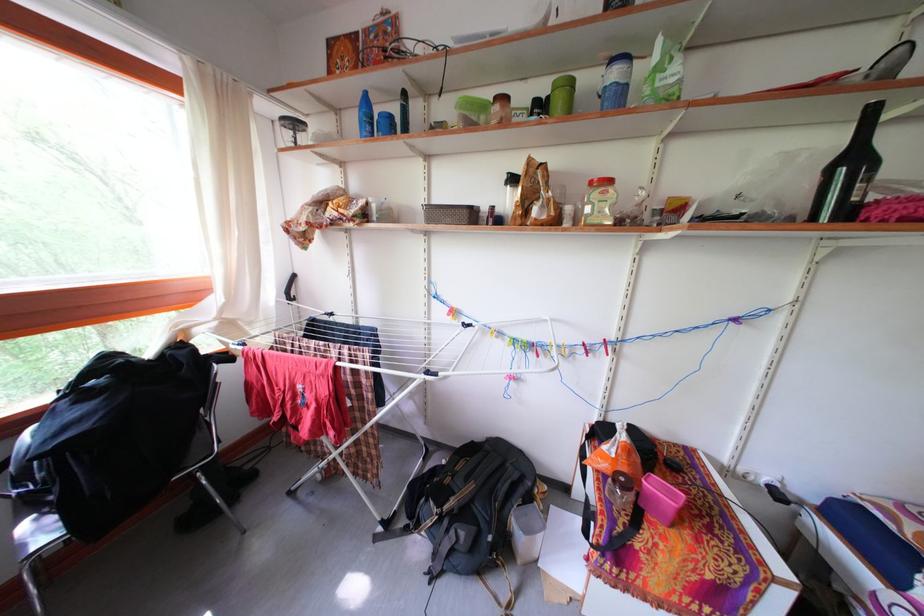
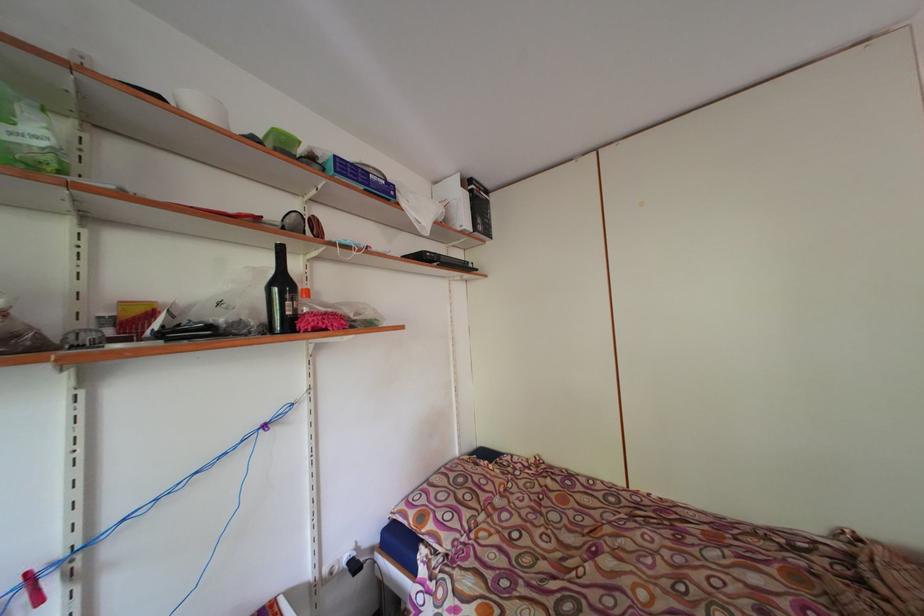
In the second image, find the point that corresponds to (x=889, y=71) in the first image.

(296, 227)